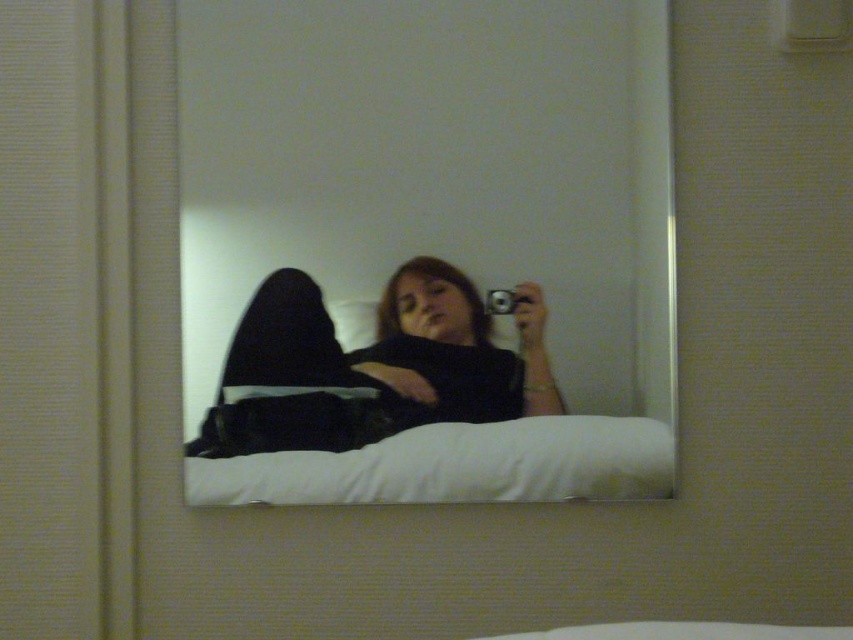
You are a photographer setting up a shot in this room. You need to position a small light between the clear glass mirror at upper center and the white soft pillow at center. Which object should the light be placed closer to, based on their positions?

The light should be placed closer to the white soft pillow at center because the clear glass mirror at upper center is closer to the viewer, meaning the pillow is farther away, so placing the light closer to the pillow would help illuminate it effectively from a distance.

You are trying to place a decorative item between the clear glass mirror at upper center and the white soft pillow at center. Based on their sizes, which object should you consider moving to make space?

The clear glass mirror at upper center might be wider than the white soft pillow at center, so moving the mirror could be necessary to create more space.

You are a photographer trying to capture the reflection in the mirror. The mirror is at the center of the image. You need to position your camera so that it captures the black matte pants at center at point [373,365]. Where should you place your camera relative to the mirror?

The black matte pants at center is located at point [373,365], so you should position your camera directly in front of the mirror at the center point to capture the reflection accurately.